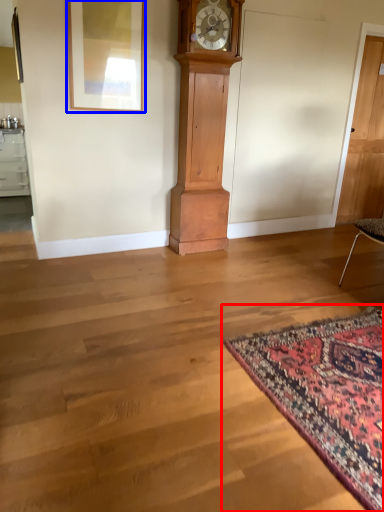
Question: Which object is further to the camera taking this photo, mat (highlighted by a red box) or picture frame (highlighted by a blue box)?

Choices:
 (A) mat
 (B) picture frame

Answer: (B)